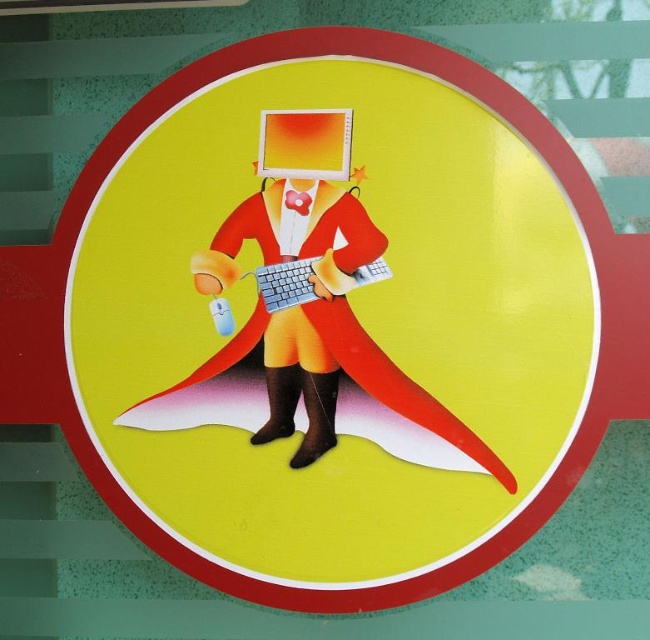
Which is more to the right, matte orange laptop at center or silver metallic keyboard at center?

Positioned to the right is silver metallic keyboard at center.

Is matte orange laptop at center below silver metallic keyboard at center?

Incorrect, matte orange laptop at center is not positioned below silver metallic keyboard at center.

The width and height of the screenshot is (650, 640). I want to click on matte orange laptop at center, so coord(306,145).

Identify the location of matte orange laptop at center. The image size is (650, 640). tap(306, 145).

Can you confirm if matte orange suit at center is positioned to the right of silver metallic keyboard at center?

No, matte orange suit at center is not to the right of silver metallic keyboard at center.

Does matte orange suit at center have a greater height compared to silver metallic keyboard at center?

Indeed, matte orange suit at center has a greater height compared to silver metallic keyboard at center.

Describe the element at coordinates (307, 280) in the screenshot. The image size is (650, 640). I see `matte orange suit at center` at that location.

Find the location of a particular element. The height and width of the screenshot is (640, 650). matte orange suit at center is located at coordinates (307, 280).

Is matte orange suit at center to the left of matte orange laptop at center from the viewer's perspective?

Indeed, matte orange suit at center is positioned on the left side of matte orange laptop at center.

Between point (294, 396) and point (339, 150), which one is positioned behind?

Positioned behind is point (294, 396).

Between point (369, 352) and point (343, 132), which one is positioned behind?

Positioned behind is point (369, 352).

You are a GUI agent. You are given a task and a screenshot of the screen. Output one action in this format:
    pyautogui.click(x=<x>, y=<y>)
    Task: Click on the matte orange suit at center
    This screenshot has width=650, height=640.
    Given the screenshot: What is the action you would take?
    pyautogui.click(x=307, y=280)